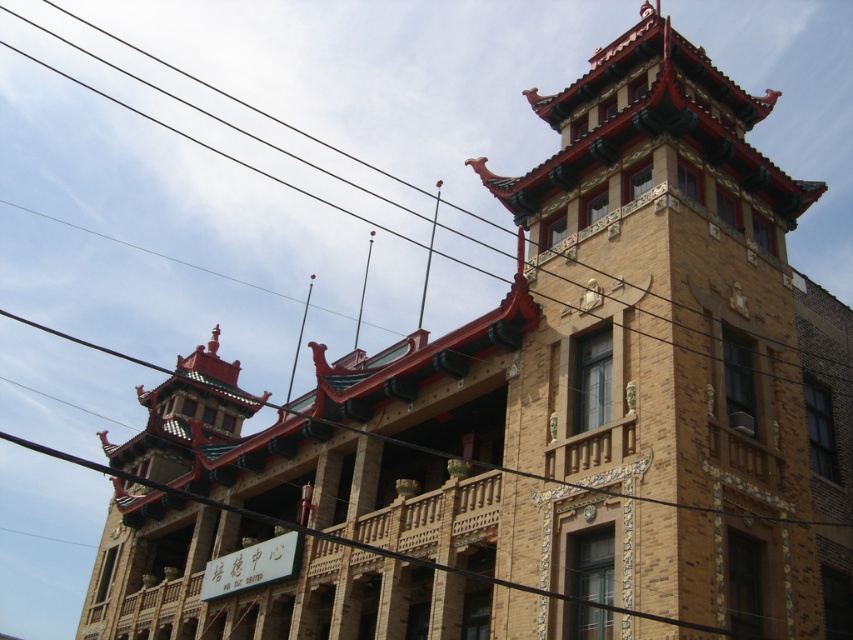
Which of these two, yellow brick tower at upper center or black wire at upper center, stands shorter?

yellow brick tower at upper center

Is yellow brick tower at upper center positioned at the back of black wire at upper center?

No, yellow brick tower at upper center is in front of black wire at upper center.

Identify the location of yellow brick tower at upper center. (659, 352).

At what (x,y) coordinates should I click in order to perform the action: click on yellow brick tower at upper center. Please return your answer as a coordinate pair (x, y). Looking at the image, I should click on (659, 352).